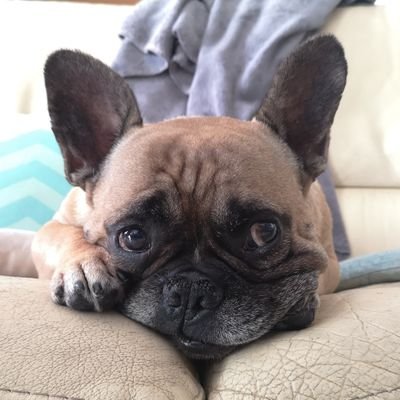
I want to click on stripy cushion, so click(21, 187).